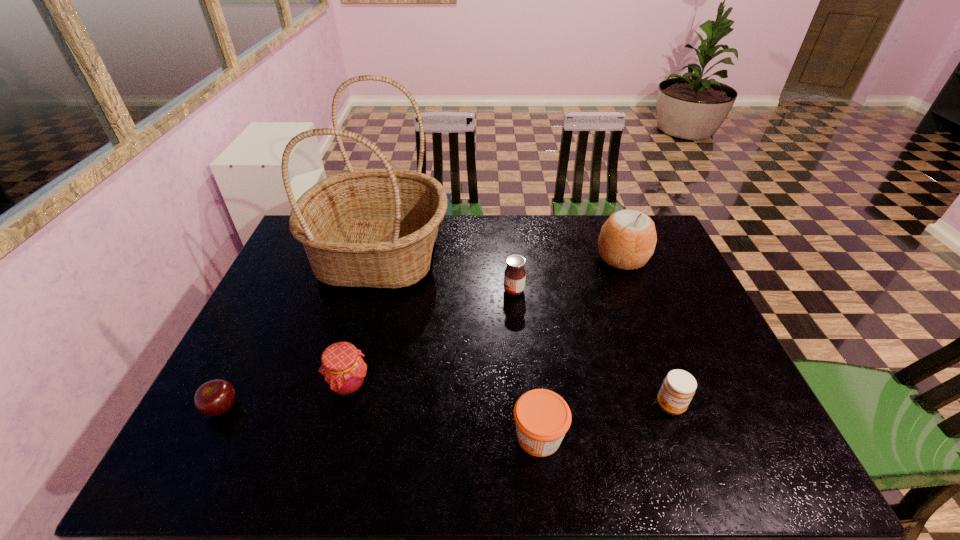
You are a GUI agent. You are given a task and a screenshot of the screen. Output one action in this format:
    pyautogui.click(x=<x>, y=<y>)
    Task: Click on the free space between the leftmost jam and the apple
    
    Given the screenshot: What is the action you would take?
    pyautogui.click(x=285, y=396)

The height and width of the screenshot is (540, 960). I want to click on free spot between the farthest jam and the second tallest object, so click(568, 274).

This screenshot has width=960, height=540. In order to click on vacant region between the apple and the rightmost jam in this screenshot , I will do (x=446, y=407).

Find the location of `vacant space that's between the farthest jam and the apple`. vacant space that's between the farthest jam and the apple is located at coordinates (368, 349).

Identify the location of the closest object to the apple. click(x=344, y=371).

Find the location of a particular element. Image resolution: width=960 pixels, height=540 pixels. object that stands as the sixth closest to the basket is located at coordinates (678, 388).

Locate which jam ranks in proximity to the farthest jam. Please provide its 2D coordinates. Your answer should be formatted as a tuple, i.e. [(x, y)], where the tuple contains the x and y coordinates of a point satisfying the conditions above.

[(542, 417)]

Locate which jam is the third closest to the leftmost jam. Please provide its 2D coordinates. Your answer should be formatted as a tuple, i.e. [(x, y)], where the tuple contains the x and y coordinates of a point satisfying the conditions above.

[(678, 388)]